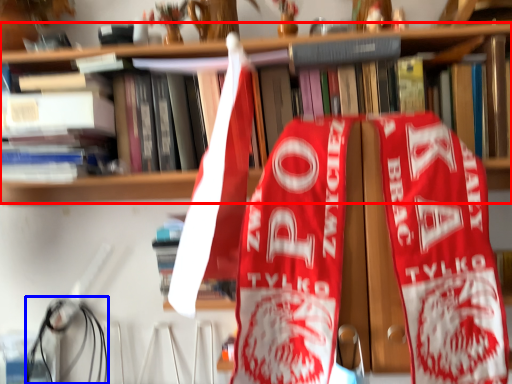
Question: Which object appears closest to the camera in this image, bookcase (highlighted by a red box) or wire (highlighted by a blue box)?

Choices:
 (A) bookcase
 (B) wire

Answer: (A)